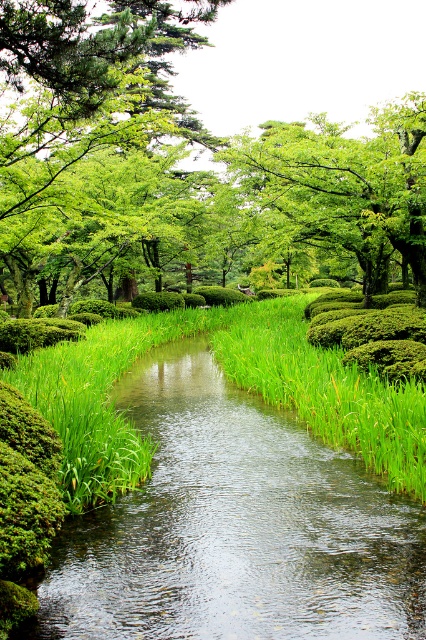
Question: Which is farther from the green grassy stream at center?

Choices:
 (A) green leafy tree at upper center
 (B) green leafy grass at center
 (C) green leafy tree at upper left

Answer: (C)

Question: Among these points, which one is farthest from the camera?

Choices:
 (A) (282, 145)
 (B) (417, 493)
 (C) (147, 205)

Answer: (A)

Question: Which of the following is the closest to the observer?

Choices:
 (A) (382, 419)
 (B) (103, 250)

Answer: (A)

Question: Is green grassy stream at center to the right of green leafy tree at upper center from the viewer's perspective?

Choices:
 (A) no
 (B) yes

Answer: (A)

Question: Is green grassy stream at center above green leafy tree at upper left?

Choices:
 (A) no
 (B) yes

Answer: (A)

Question: Does green leafy tree at upper left appear on the right side of green leafy tree at upper center?

Choices:
 (A) yes
 (B) no

Answer: (B)